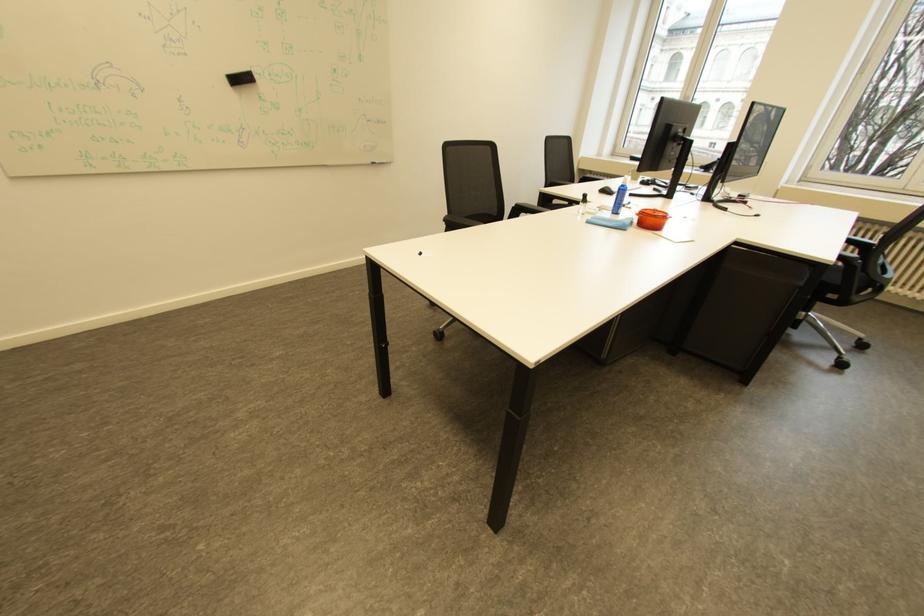
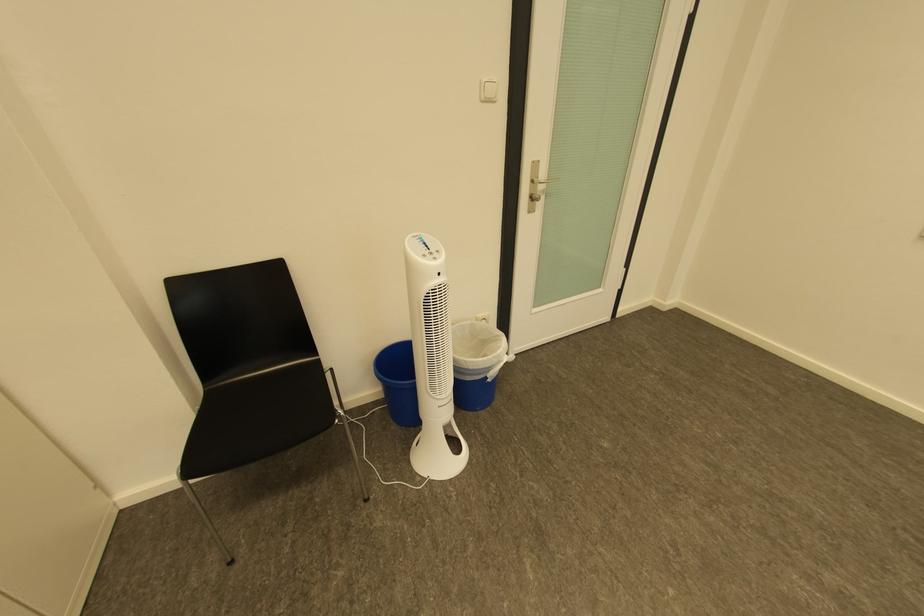
First-person continuous shooting, in which direction is the camera rotating?

The camera rotated toward left-down.